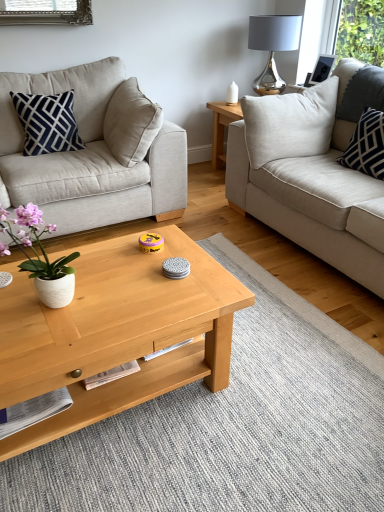
The image size is (384, 512). Identify the location of empty space that is ontop of light wood/texture coffee table at center (from a real-world perspective). (91, 292).